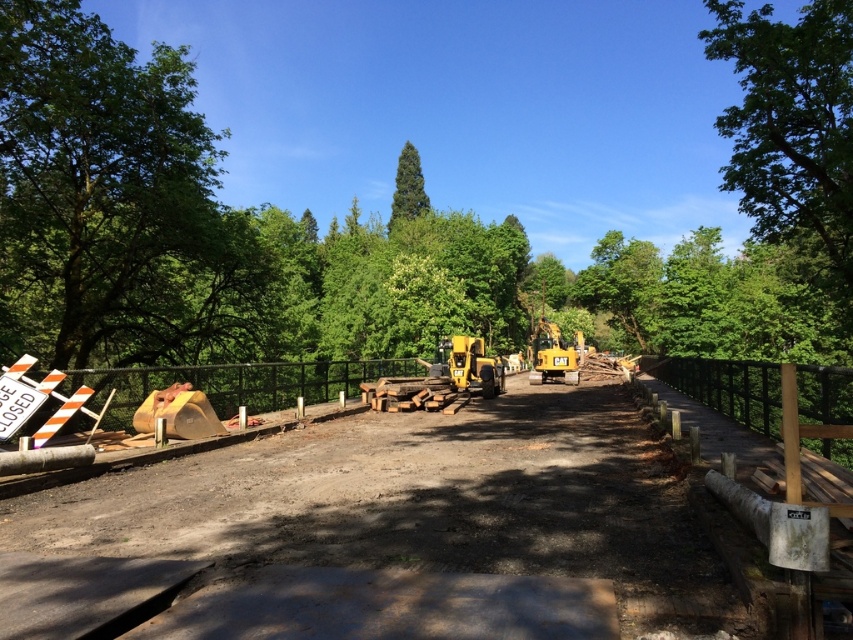
Question: Which of these objects is positioned closest to the matte yellow construction equipment at center?

Choices:
 (A) yellow metallic excavator at center
 (B) green leafy tree at left

Answer: (B)

Question: Where is matte yellow construction equipment at center located in relation to yellow rubber excavator at center in the image?

Choices:
 (A) right
 (B) left

Answer: (B)

Question: Which of the following is the farthest from the observer?

Choices:
 (A) (567, 348)
 (B) (454, 362)
 (C) (387, 420)
 (D) (396, 202)

Answer: (D)

Question: Based on their relative distances, which object is farther from the green leafy tree at left?

Choices:
 (A) matte yellow construction equipment at center
 (B) green matte tree at center
 (C) yellow metallic excavator at center
 (D) yellow rubber excavator at center

Answer: (B)

Question: Can you confirm if matte yellow construction equipment at center is positioned to the right of green leafy tree at left?

Choices:
 (A) yes
 (B) no

Answer: (A)

Question: Does matte yellow construction equipment at center appear under yellow rubber excavator at center?

Choices:
 (A) no
 (B) yes

Answer: (B)